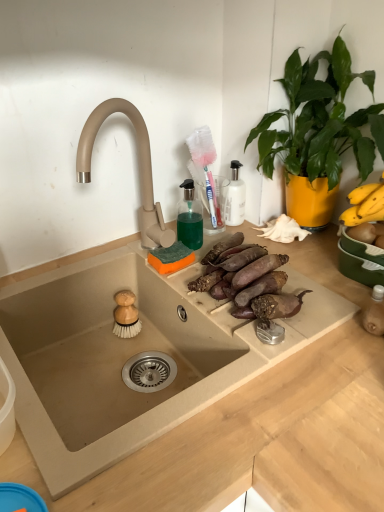
What do you see at coordinates (130, 342) in the screenshot?
I see `beige stone sink at center` at bounding box center [130, 342].

Measure the distance between point (231, 281) and camera.

31.18 inches.

Identify the location of brown rough sweet potatoes at center. This screenshot has height=512, width=384. (243, 276).

Where is `green leafy plant at upper right`? green leafy plant at upper right is located at coordinates (320, 123).

You are a GUI agent. You are given a task and a screenshot of the screen. Output one action in this format:
    pyautogui.click(x=<x>, y=<y>)
    Task: Click on the beige stone sink at center
    
    Given the screenshot: What is the action you would take?
    pyautogui.click(x=130, y=342)

Which is further, (x=187, y=358) or (x=249, y=302)?

The point (x=187, y=358) is farther from the camera.

Is beige stone sink at center positioned with its back to brown rough sweet potatoes at center?

No, brown rough sweet potatoes at center is not at the back of beige stone sink at center.

Is beige stone sink at center touching brown rough sweet potatoes at center?

No, beige stone sink at center is not next to brown rough sweet potatoes at center.

Is beige stone sink at center shorter than brown rough sweet potatoes at center?

In fact, beige stone sink at center may be taller than brown rough sweet potatoes at center.

Is green leafy plant at upper right far from beige stone sink at center?

green leafy plant at upper right is actually quite close to beige stone sink at center.

Does green leafy plant at upper right have a smaller size compared to beige stone sink at center?

Yes.

Would you say green leafy plant at upper right is inside or outside beige stone sink at center?

green leafy plant at upper right is not inside beige stone sink at center, it's outside.

Is green leafy plant at upper right thinner than beige stone sink at center?

Correct, the width of green leafy plant at upper right is less than that of beige stone sink at center.

Between beige stone sink at center and green leafy plant at upper right, which one has less height?

Standing shorter between the two is beige stone sink at center.

Considering the sizes of objects beige stone sink at center and green leafy plant at upper right in the image provided, who is wider, beige stone sink at center or green leafy plant at upper right?

beige stone sink at center.

How much distance is there between beige stone sink at center and green leafy plant at upper right?

beige stone sink at center and green leafy plant at upper right are 15.81 inches apart.

Which object is positioned more to the left, beige stone sink at center or green leafy plant at upper right?

From the viewer's perspective, beige stone sink at center appears more on the left side.

In the image, is brown rough sweet potatoes at center positioned in front of or behind beige stone sink at center?

brown rough sweet potatoes at center is behind beige stone sink at center.

Which of these two, brown rough sweet potatoes at center or beige stone sink at center, is bigger?

Bigger between the two is beige stone sink at center.

Does brown rough sweet potatoes at center have a greater width compared to beige stone sink at center?

Incorrect, the width of brown rough sweet potatoes at center does not surpass that of beige stone sink at center.

What's the angular difference between green leafy plant at upper right and brown rough sweet potatoes at center's facing directions?

The facing directions of green leafy plant at upper right and brown rough sweet potatoes at center are 89.2 degrees apart.

Is green leafy plant at upper right wider or thinner than brown rough sweet potatoes at center?

Clearly, green leafy plant at upper right has more width compared to brown rough sweet potatoes at center.

Looking at this image, is green leafy plant at upper right facing away from brown rough sweet potatoes at center?

No, brown rough sweet potatoes at center is not at the back of green leafy plant at upper right.

Considering the positions of objects brown rough sweet potatoes at center and green leafy plant at upper right in the image provided, who is more to the right, brown rough sweet potatoes at center or green leafy plant at upper right?

green leafy plant at upper right.

Is the position of brown rough sweet potatoes at center more distant than that of green leafy plant at upper right?

Yes, it is behind green leafy plant at upper right.

Based on the photo, does brown rough sweet potatoes at center touch green leafy plant at upper right?

No, brown rough sweet potatoes at center is not beside green leafy plant at upper right.

Locate an element on the screen. food located behind the green leafy plant at upper right is located at coordinates (243, 276).

This screenshot has width=384, height=512. In the image, there is a brown rough sweet potatoes at center. What are the coordinates of `sink below it (from a real-world perspective)` in the screenshot? It's located at (130, 342).

The image size is (384, 512). I want to click on houseplant above the beige stone sink at center (from a real-world perspective), so click(x=320, y=123).

Looking at this image, based on their spatial positions, is beige stone sink at center or brown rough sweet potatoes at center further from green leafy plant at upper right?

Among the two, beige stone sink at center is located further to green leafy plant at upper right.

When comparing their distances from brown rough sweet potatoes at center, does beige stone sink at center or green leafy plant at upper right seem further?

Based on the image, green leafy plant at upper right appears to be further to brown rough sweet potatoes at center.

Based on their spatial positions, is green leafy plant at upper right or beige stone sink at center closer to brown rough sweet potatoes at center?

beige stone sink at center.

When comparing their distances from beige stone sink at center, does green leafy plant at upper right or brown rough sweet potatoes at center seem further?

green leafy plant at upper right is positioned further to the anchor beige stone sink at center.

Which object lies nearer to the anchor point green leafy plant at upper right, brown rough sweet potatoes at center or beige stone sink at center?

brown rough sweet potatoes at center lies closer to green leafy plant at upper right than the other object.

Which object lies nearer to the anchor point beige stone sink at center, brown rough sweet potatoes at center or green leafy plant at upper right?

brown rough sweet potatoes at center lies closer to beige stone sink at center than the other object.

Identify the location of food that lies between green leafy plant at upper right and beige stone sink at center from top to bottom. The height and width of the screenshot is (512, 384). (243, 276).